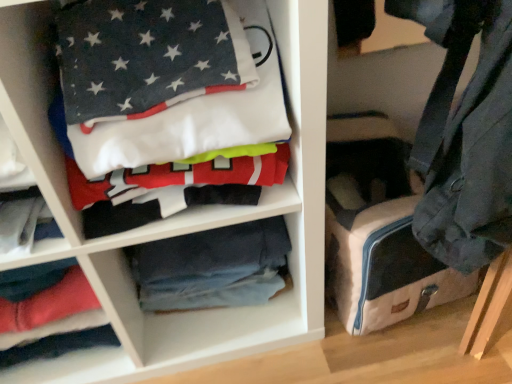
Question: Is dark blue cotton t-shirt at upper left in front of or behind canvas suitcase at lower right in the image?

Choices:
 (A) front
 (B) behind

Answer: (A)

Question: In terms of height, does dark blue cotton t-shirt at upper left look taller or shorter compared to canvas suitcase at lower right?

Choices:
 (A) tall
 (B) short

Answer: (B)

Question: Estimate the real-world distances between objects in this image. Which object is closer to the blue denim jeans at center?

Choices:
 (A) dark blue cotton t-shirt at upper left
 (B) canvas suitcase at lower right

Answer: (B)

Question: Which object is the farthest from the canvas suitcase at lower right?

Choices:
 (A) blue denim jeans at center
 (B) dark blue cotton t-shirt at upper left

Answer: (B)